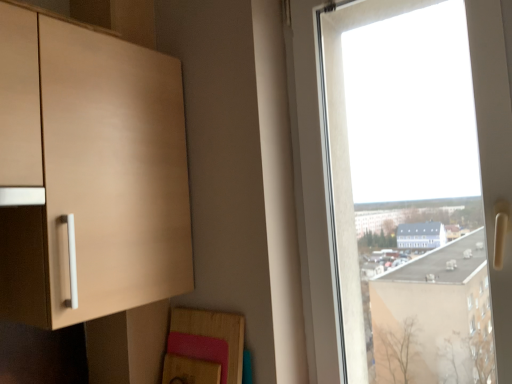
The image size is (512, 384). What are the coordinates of `wooden cutting board at lower center` in the screenshot? It's located at (206, 346).

What do you see at coordinates (206, 346) in the screenshot? I see `wooden cutting board at lower center` at bounding box center [206, 346].

The width and height of the screenshot is (512, 384). Find the location of `wooden cutting board at lower center`. wooden cutting board at lower center is located at coordinates (206, 346).